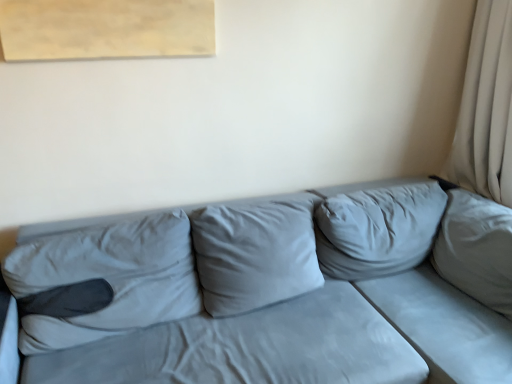
Question: Considering the positions of point (101, 296) and point (481, 175), is point (101, 296) closer or farther from the camera than point (481, 175)?

Choices:
 (A) closer
 (B) farther

Answer: (A)

Question: Based on their sizes in the image, would you say suede gray couch at center is bigger or smaller than beige fabric curtain at right?

Choices:
 (A) big
 (B) small

Answer: (A)

Question: From the image's perspective, relative to beige fabric curtain at right, is suede gray couch at center above or below?

Choices:
 (A) above
 (B) below

Answer: (B)

Question: Considering their positions, is beige fabric curtain at right located in front of or behind suede gray couch at center?

Choices:
 (A) behind
 (B) front

Answer: (A)

Question: From a real-world perspective, is beige fabric curtain at right physically located above or below suede gray couch at center?

Choices:
 (A) above
 (B) below

Answer: (A)

Question: Considering the relative positions of beige fabric curtain at right and suede gray couch at center in the image provided, is beige fabric curtain at right to the left or to the right of suede gray couch at center?

Choices:
 (A) left
 (B) right

Answer: (B)

Question: In terms of size, does beige fabric curtain at right appear bigger or smaller than suede gray couch at center?

Choices:
 (A) small
 (B) big

Answer: (A)